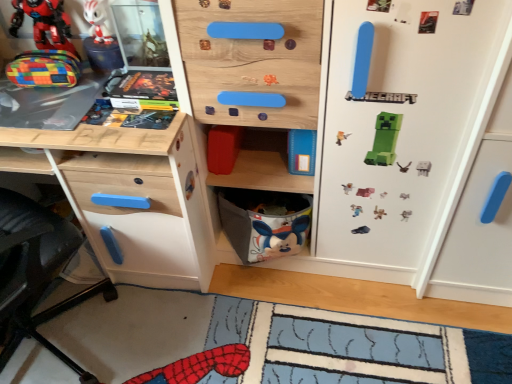
Locate an element on the screen. The image size is (512, 384). free space in front of matte plastic toy at upper left, positioned as the second toy in top-to-bottom order is located at coordinates (41, 99).